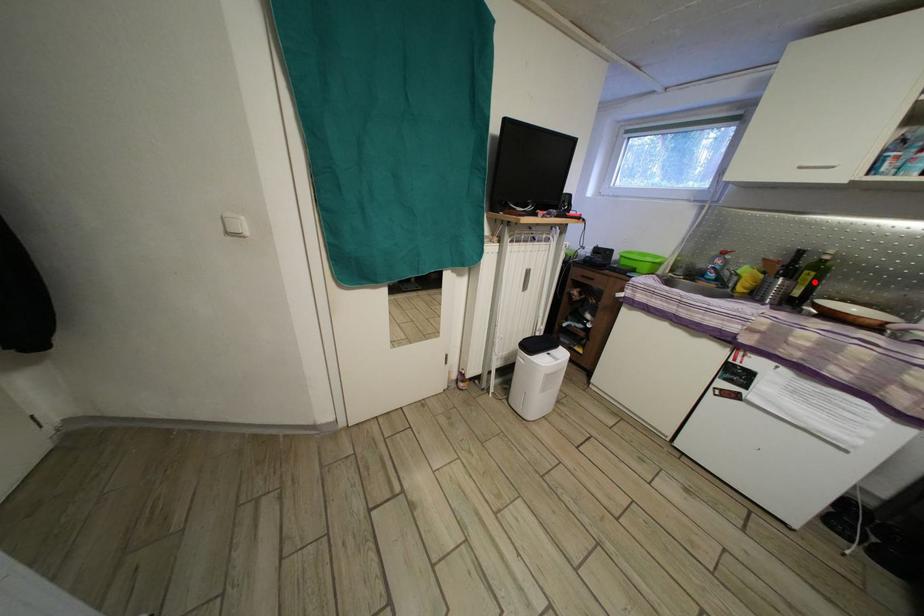
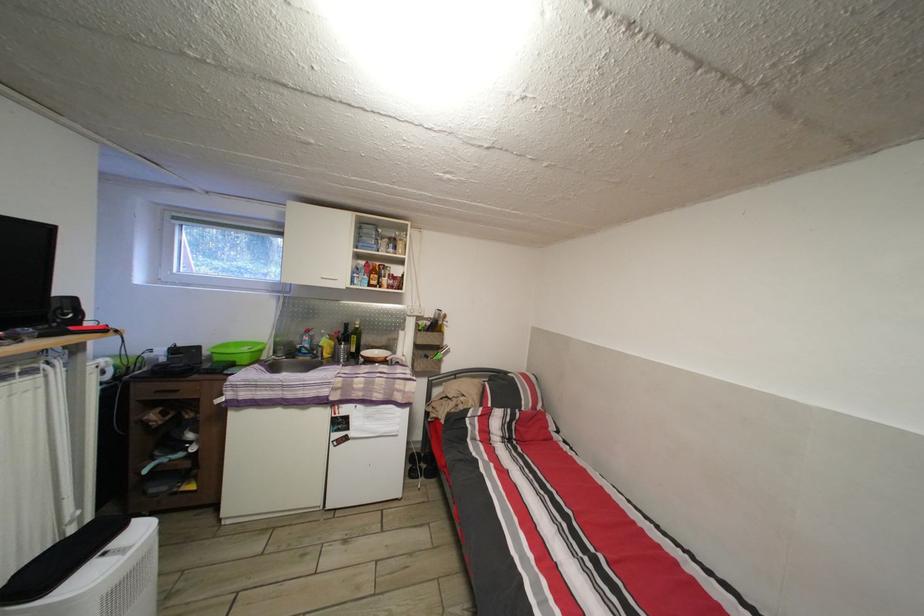
Locate, in the second image, the point that corresponds to the highlighted location in the first image.

(360, 345)